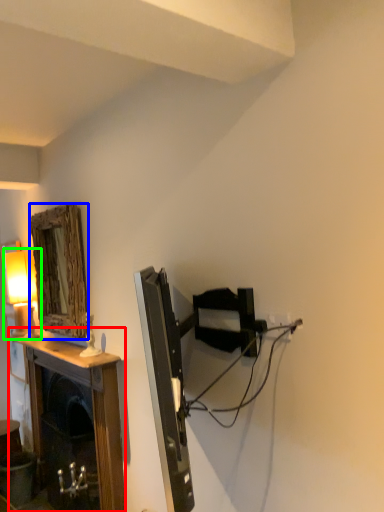
Question: Which object is the farthest from table (highlighted by a red box)? Choose among these: mirror (highlighted by a blue box) or table lamp (highlighted by a green box).

Choices:
 (A) mirror
 (B) table lamp

Answer: (B)